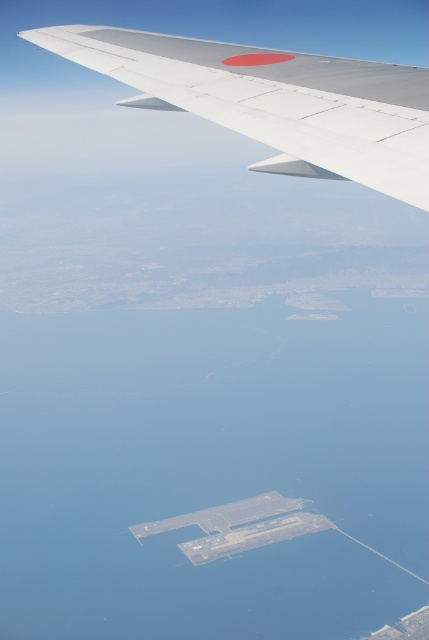
You are a passenger on an airplane and want to take a photo of the transparent water at center and the metallic gray wing at upper left. Which object should you focus on first if you want to capture both in the same frame?

The transparent water at center is positioned on the left side of metallic gray wing at upper left, so you should focus on the metallic gray wing at upper left first to ensure both objects are in the same frame.

You are an air traffic controller analyzing the image from the airplane window. You need to determine the exact 2D coordinates of the transparent water at center. What are its coordinates?

The transparent water at center is located at the 2D coordinates point of (211, 468).